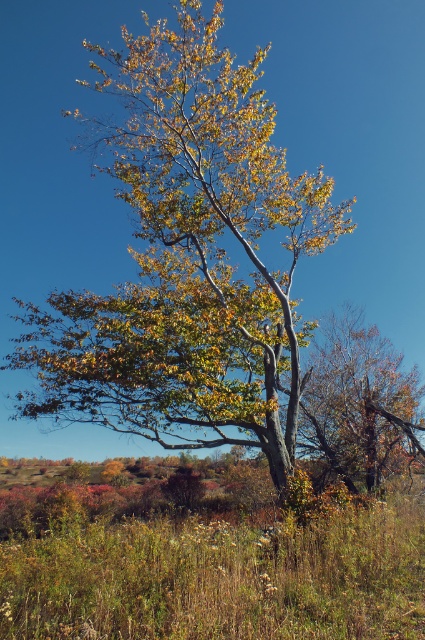
You are standing in the autumnal landscape and want to place a small decorative rock between the two points, point 1 at point (210,557) and point 2 at point (357,445). Which point should the rock be closer to if you want it to appear larger in the photo?

The rock should be placed closer to point 1 at point (210,557) because it is closer to the camera, making the rock appear larger in the photo.

You are standing in the autumnal landscape and want to place a small decorative rock between the green grass at center and the autumn leaves at center. Which object should you place it closer to if you want the rock to be more visible against the background?

You should place the rock closer to the autumn leaves at center because they are smaller in size compared to the green grass at center, making the rock more visible against the background.

You are standing in the autumnal landscape and want to place a small bench exactly 5 meters away from where you are standing. Can you place it on the green grass at center?

The green grass at center is 4.98 meters away from the viewer, which is just under 5 meters. Therefore, placing the bench there would be slightly closer than desired, but very nearly 5 meters.